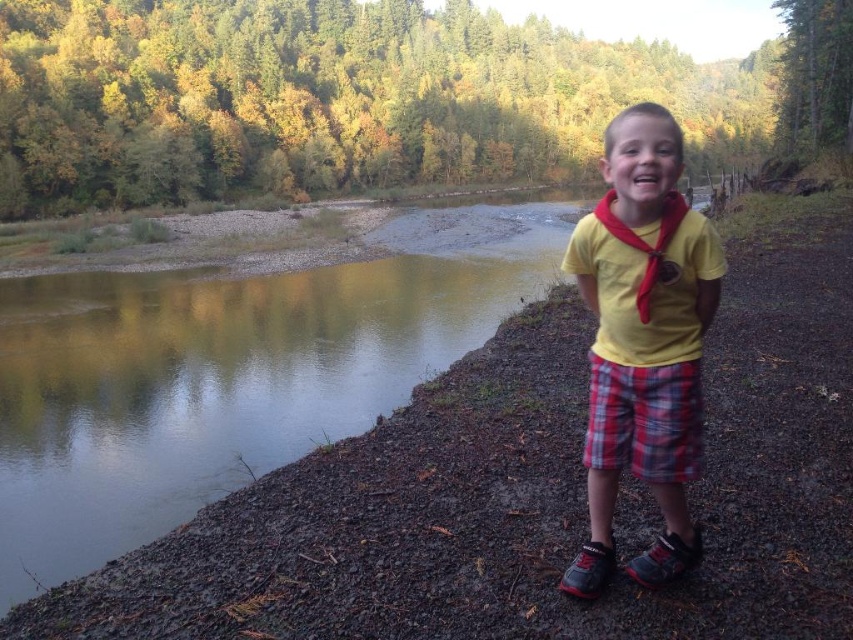
This screenshot has width=853, height=640. In order to click on green reflective water at lower left in this screenshot , I will do `click(230, 372)`.

Locate an element on the screen. This screenshot has width=853, height=640. green reflective water at lower left is located at coordinates (230, 372).

Does yellow cotton shirt at center appear on the left side of plaid fabric shorts at right?

No, yellow cotton shirt at center is not to the left of plaid fabric shorts at right.

Between point (567, 584) and point (656, 440), which one is positioned behind?

The point (567, 584) is more distant.

Which is in front, point (656, 381) or point (657, 424)?

Positioned in front is point (656, 381).

Identify the location of yellow cotton shirt at center. (642, 342).

Who is more forward, (312,380) or (595,589)?

Point (595,589) is more forward.

Between point (445, 288) and point (699, 243), which one is positioned in front?

Point (699, 243) is in front.

This screenshot has width=853, height=640. In order to click on green reflective water at lower left in this screenshot , I will do `click(230, 372)`.